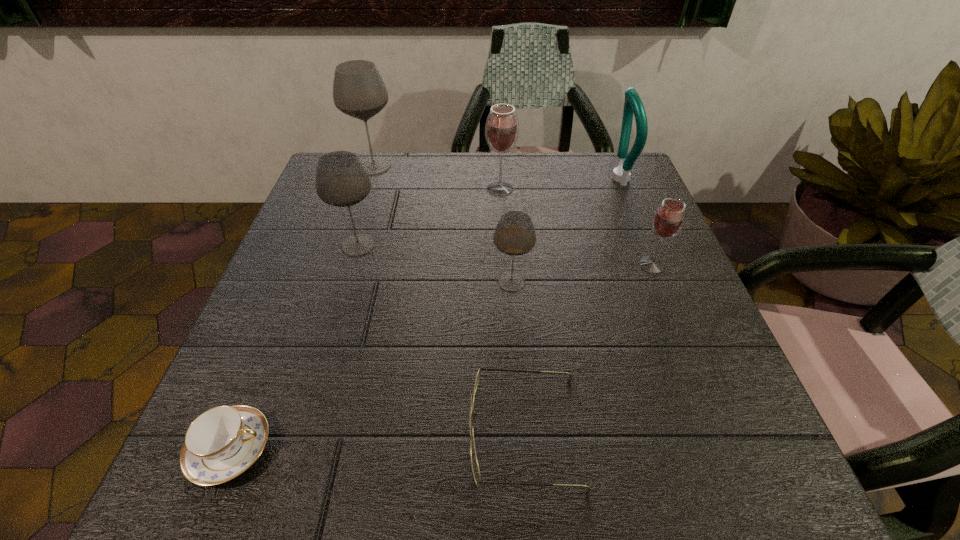
Locate an element on the screen. free space between the smallest gray wineglass and the green bottle opener is located at coordinates (564, 230).

Identify the location of vacant space that is in between the nearest gray wineglass and the second smallest gray wineglass. (435, 264).

The height and width of the screenshot is (540, 960). Identify the location of vacant region between the blue teacup and the smallest gray wineglass. (372, 366).

Find the location of a particular element. This screenshot has width=960, height=540. empty space between the bigger red wineglass and the farthest gray wineglass is located at coordinates (437, 177).

You are a GUI agent. You are given a task and a screenshot of the screen. Output one action in this format:
    pyautogui.click(x=<x>, y=<y>)
    Task: Click on the vacant space that is in between the second farthest gray wineglass and the beige spectacles
    
    Given the screenshot: What is the action you would take?
    pyautogui.click(x=442, y=339)

Where is `blank region between the right red wineglass and the blue teacup`? blank region between the right red wineglass and the blue teacup is located at coordinates (442, 357).

Find the location of `free spot between the farther red wineglass and the green bottle opener`. free spot between the farther red wineglass and the green bottle opener is located at coordinates (559, 184).

Find the location of a particular element. This screenshot has width=960, height=540. free spot between the second smallest gray wineglass and the farthest gray wineglass is located at coordinates (366, 206).

Choose which object is the nearest neighbor to the nearest gray wineglass. Please provide its 2D coordinates. Your answer should be formatted as a tuple, i.e. [(x, y)], where the tuple contains the x and y coordinates of a point satisfying the conditions above.

[(474, 462)]

At what (x,y) coordinates should I click in order to perform the action: click on object that stands as the closest to the nearer red wineglass. Please return your answer as a coordinate pair (x, y). Looking at the image, I should click on coord(633,104).